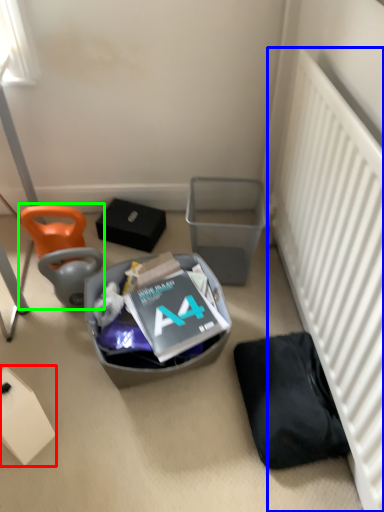
Question: Considering the real-world distances, which object is farthest from box (highlighted by a red box)? radiator (highlighted by a blue box) or bean bag chair (highlighted by a green box)?

Choices:
 (A) radiator
 (B) bean bag chair

Answer: (A)